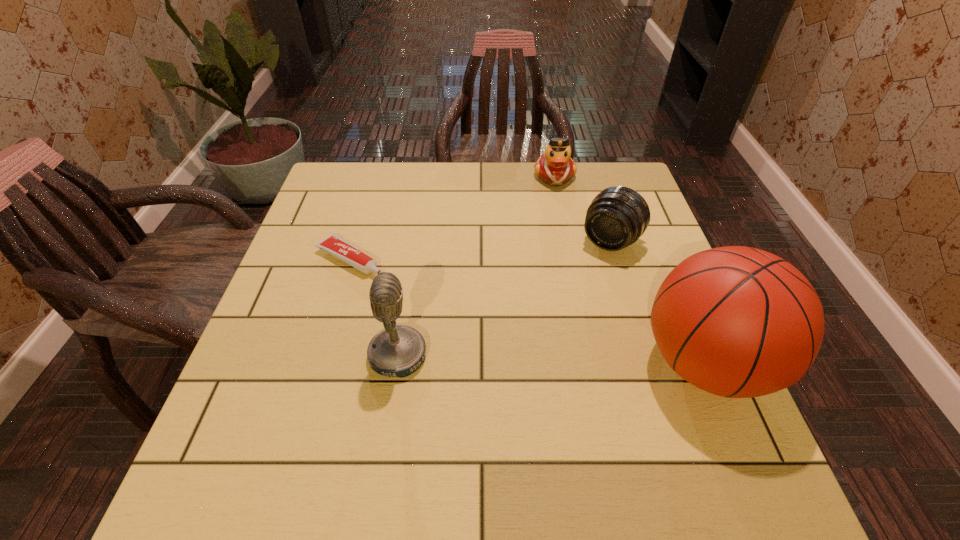
I want to click on free space between the shortest object and the tallest object, so click(x=527, y=311).

Where is `vacant area that lies between the duck and the basketball`? This screenshot has height=540, width=960. vacant area that lies between the duck and the basketball is located at coordinates (630, 269).

Find the location of `object that is the fourth nearest to the microphone`. object that is the fourth nearest to the microphone is located at coordinates (555, 167).

Where is `object that stands as the fourth closest to the leftmost object`? object that stands as the fourth closest to the leftmost object is located at coordinates (739, 322).

The width and height of the screenshot is (960, 540). I want to click on free space that satisfies the following two spatial constraints: 1. on the front side of the duck; 2. on the right side of the telephoto lens, so click(x=568, y=241).

Where is `vacant space that satisfies the following two spatial constraints: 1. on the front side of the telephoto lens; 2. on the right side of the farthest object`? The height and width of the screenshot is (540, 960). vacant space that satisfies the following two spatial constraints: 1. on the front side of the telephoto lens; 2. on the right side of the farthest object is located at coordinates (568, 241).

Find the location of a particular element. Image resolution: width=960 pixels, height=540 pixels. vacant point that satisfies the following two spatial constraints: 1. on the front side of the leftmost object; 2. on the left side of the tallest object is located at coordinates (320, 363).